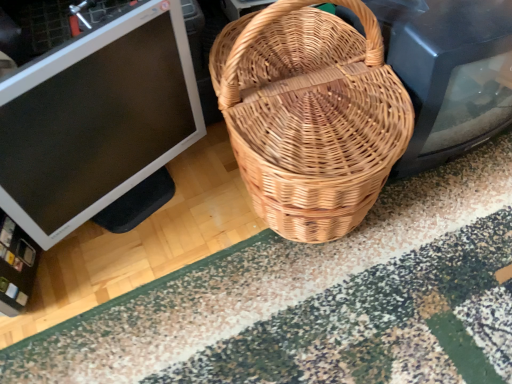
This screenshot has height=384, width=512. Find the location of `spots to the right of matte black monitor at left`. spots to the right of matte black monitor at left is located at coordinates (210, 226).